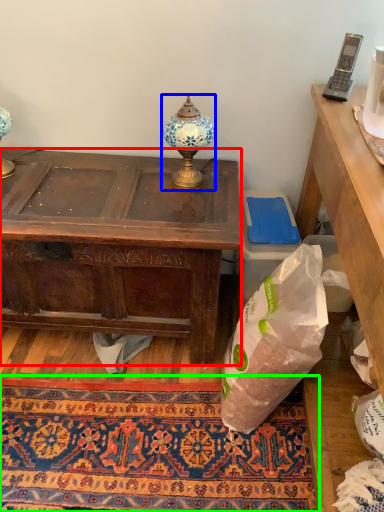
Question: Based on their relative distances, which object is farther from desk (highlighted by a red box)? Choose from lamp (highlighted by a blue box) and mat (highlighted by a green box).

Choices:
 (A) lamp
 (B) mat

Answer: (B)